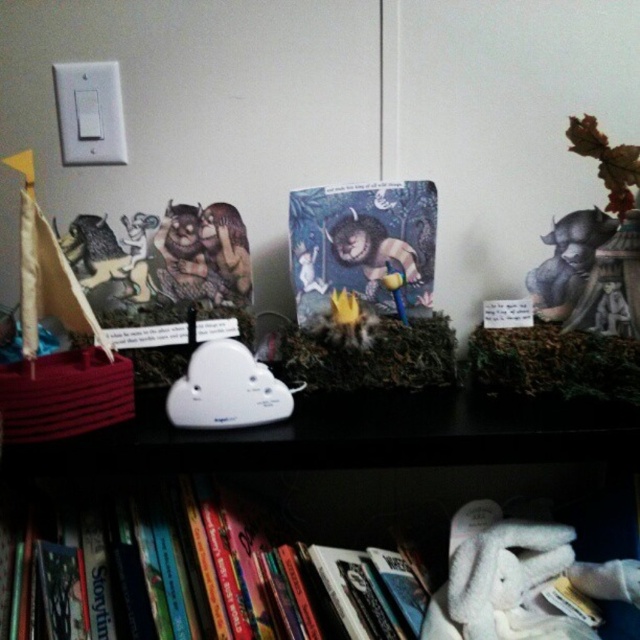
You are standing 30 inches away from the shelf and want to reach the hardcover books at center. Can you touch them without moving your position?

The hardcover books at center is 24.98 inches away from camera, so yes, you can touch them without moving your position since the distance is within your reach.